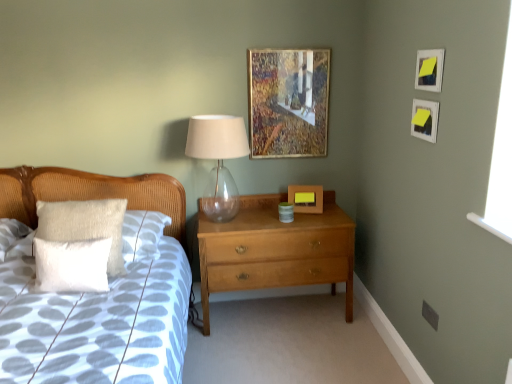
Question: Is transparent glass table lamp at center positioned far away from matte white picture frame at upper right, acting as the 3th picture frame starting from the back?

Choices:
 (A) no
 (B) yes

Answer: (B)

Question: Is transparent glass table lamp at center oriented towards matte white picture frame at upper right, acting as the 3th picture frame starting from the back?

Choices:
 (A) yes
 (B) no

Answer: (B)

Question: Considering the relative sizes of transparent glass table lamp at center and matte white picture frame at upper right, acting as the 3th picture frame starting from the back, in the image provided, is transparent glass table lamp at center bigger than matte white picture frame at upper right, acting as the 3th picture frame starting from the back,?

Choices:
 (A) no
 (B) yes

Answer: (B)

Question: Is transparent glass table lamp at center behind matte white picture frame at upper right, which is counted as the fourth picture frame, starting from the left?

Choices:
 (A) yes
 (B) no

Answer: (A)

Question: Is transparent glass table lamp at center looking in the opposite direction of matte white picture frame at upper right, which is counted as the fourth picture frame, starting from the left?

Choices:
 (A) yes
 (B) no

Answer: (B)

Question: From a real-world perspective, is wooden picture frame at center, positioned as the 2th picture frame in left-to-right order, physically located above or below matte white picture frame at upper right, acting as the 3th picture frame starting from the back?

Choices:
 (A) below
 (B) above

Answer: (A)

Question: Is wooden picture frame at center, the 4th picture frame when ordered from front to back, to the left or to the right of matte white picture frame at upper right, which is counted as the fourth picture frame, starting from the left, in the image?

Choices:
 (A) right
 (B) left

Answer: (B)

Question: Considering the positions of wooden picture frame at center, positioned as the 2th picture frame in left-to-right order, and matte white picture frame at upper right, which is counted as the fourth picture frame, starting from the left, in the image, is wooden picture frame at center, positioned as the 2th picture frame in left-to-right order, bigger or smaller than matte white picture frame at upper right, which is counted as the fourth picture frame, starting from the left,?

Choices:
 (A) big
 (B) small

Answer: (A)

Question: Is point (308, 208) closer or farther from the camera than point (414, 124)?

Choices:
 (A) farther
 (B) closer

Answer: (A)

Question: From the image's perspective, relative to white soft pillow at left, is transparent glass table lamp at center above or below?

Choices:
 (A) above
 (B) below

Answer: (A)

Question: Is transparent glass table lamp at center situated inside white soft pillow at left or outside?

Choices:
 (A) inside
 (B) outside

Answer: (B)

Question: Is transparent glass table lamp at center wider or thinner than white soft pillow at left?

Choices:
 (A) wide
 (B) thin

Answer: (B)

Question: In the image, is transparent glass table lamp at center on the left side or the right side of white soft pillow at left?

Choices:
 (A) right
 (B) left

Answer: (A)

Question: From a real-world perspective, relative to yellow paper at upper right, the second picture frame positioned from the right, is transparent glass table lamp at center vertically above or below?

Choices:
 (A) above
 (B) below

Answer: (B)

Question: Is point (216, 211) positioned closer to the camera than point (435, 77)?

Choices:
 (A) farther
 (B) closer

Answer: (A)